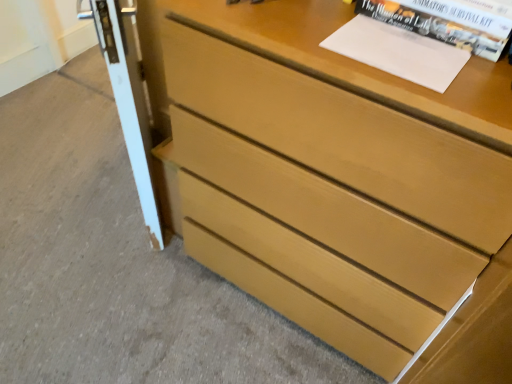
Question: Considering the relative positions of white glossy screen door at left and white paper at upper right in the image provided, is white glossy screen door at left to the right of white paper at upper right from the viewer's perspective?

Choices:
 (A) yes
 (B) no

Answer: (B)

Question: Is white glossy screen door at left taller than white paper at upper right?

Choices:
 (A) yes
 (B) no

Answer: (A)

Question: Can you confirm if white glossy screen door at left is positioned to the left of white paper at upper right?

Choices:
 (A) no
 (B) yes

Answer: (B)

Question: Is the depth of white glossy screen door at left greater than that of white paper at upper right?

Choices:
 (A) no
 (B) yes

Answer: (B)

Question: Considering the relative sizes of white glossy screen door at left and white paper at upper right in the image provided, is white glossy screen door at left shorter than white paper at upper right?

Choices:
 (A) yes
 (B) no

Answer: (B)

Question: From a real-world perspective, is white glossy screen door at left located higher than white paper at upper right?

Choices:
 (A) no
 (B) yes

Answer: (A)

Question: Is light brown wood chest of drawers at center bigger than white glossy screen door at left?

Choices:
 (A) yes
 (B) no

Answer: (A)

Question: From the image's perspective, would you say light brown wood chest of drawers at center is positioned over white glossy screen door at left?

Choices:
 (A) yes
 (B) no

Answer: (B)

Question: Does light brown wood chest of drawers at center have a lesser width compared to white glossy screen door at left?

Choices:
 (A) yes
 (B) no

Answer: (B)

Question: Is light brown wood chest of drawers at center to the left of white glossy screen door at left from the viewer's perspective?

Choices:
 (A) yes
 (B) no

Answer: (B)

Question: Is light brown wood chest of drawers at center far from white glossy screen door at left?

Choices:
 (A) no
 (B) yes

Answer: (A)

Question: Considering the relative sizes of light brown wood chest of drawers at center and white glossy screen door at left in the image provided, is light brown wood chest of drawers at center shorter than white glossy screen door at left?

Choices:
 (A) no
 (B) yes

Answer: (A)

Question: Does light brown wood chest of drawers at center have a lesser height compared to white paper at upper right?

Choices:
 (A) yes
 (B) no

Answer: (B)